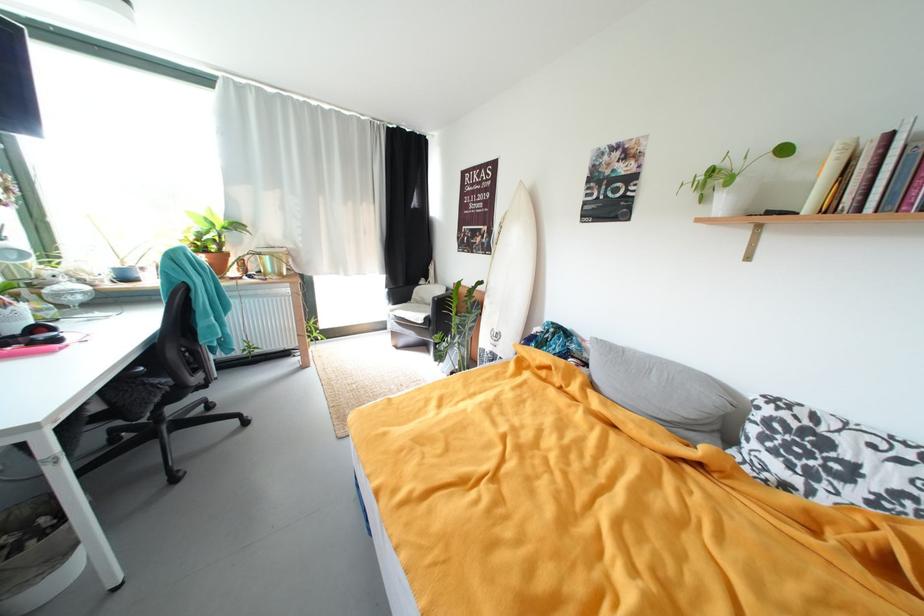
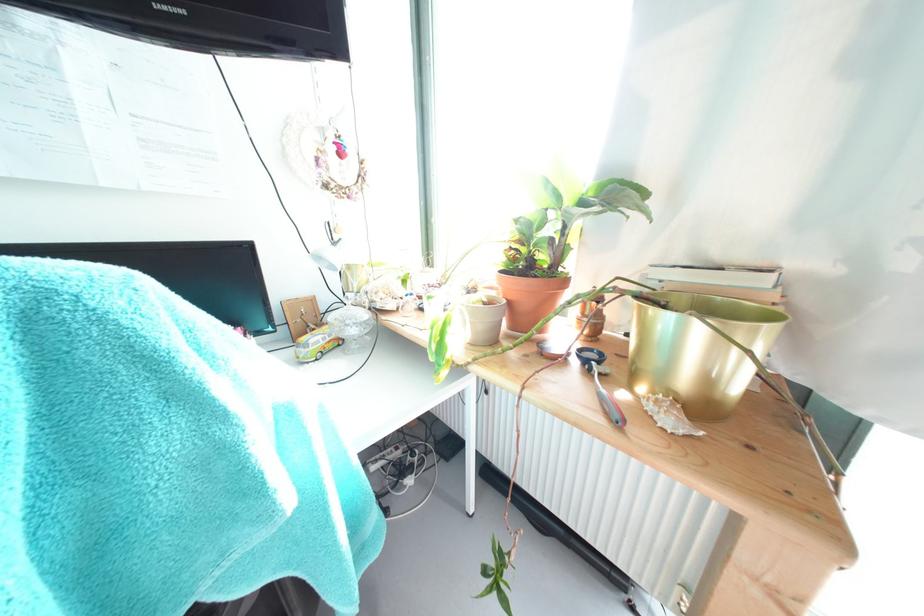
Where in the second image is the point corresponding to (x=274, y=261) from the first image?

(675, 321)